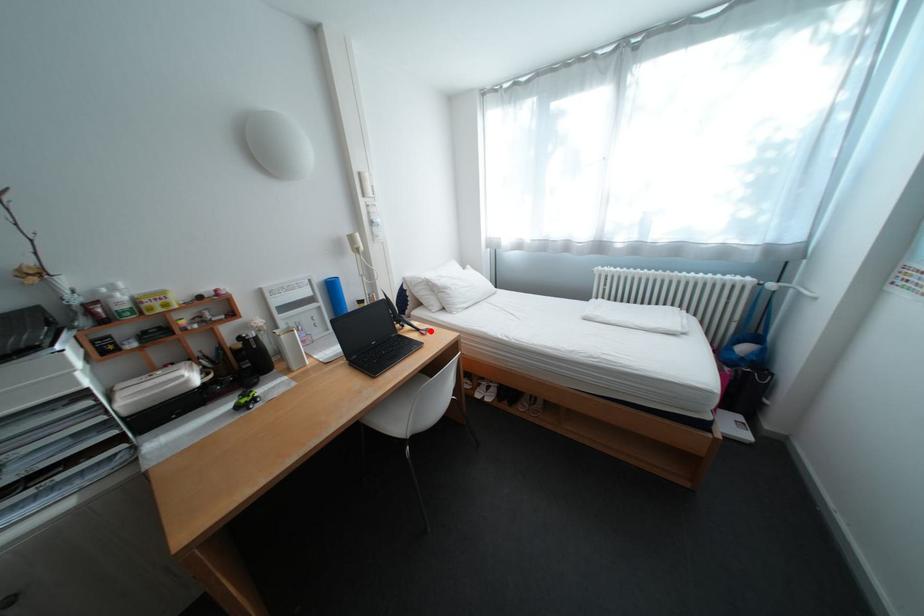
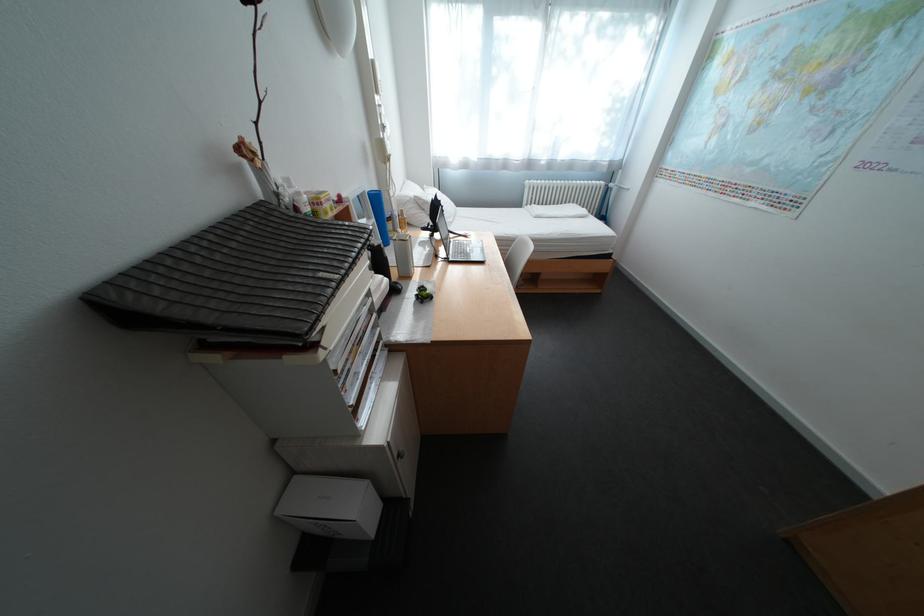
Question: I am providing you with two images of the same scene from different viewpoints. Given a red point in image1, look at the same physical point in image2. Is it:

Choices:
 (A) Closer to the viewpoint
 (B) Farther from the viewpoint

Answer: (B)